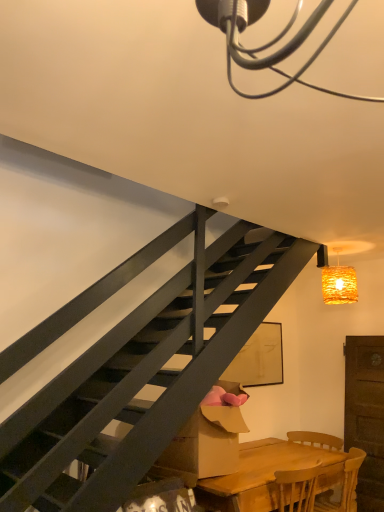
Question: Is wooden chair at lower right positioned beyond the bounds of wooden table at lower right?

Choices:
 (A) no
 (B) yes

Answer: (A)

Question: Would you consider wooden chair at lower right to be distant from wooden table at lower right?

Choices:
 (A) no
 (B) yes

Answer: (A)

Question: Does wooden chair at lower right have a lesser width compared to wooden table at lower right?

Choices:
 (A) yes
 (B) no

Answer: (A)

Question: Does wooden chair at lower right have a lesser height compared to wooden table at lower right?

Choices:
 (A) no
 (B) yes

Answer: (B)

Question: From a real-world perspective, is wooden chair at lower right under wooden table at lower right?

Choices:
 (A) yes
 (B) no

Answer: (B)

Question: Relative to cardboard box at lower center, is woven wicker lampshade at upper right in front or behind?

Choices:
 (A) front
 (B) behind

Answer: (B)

Question: In terms of size, does woven wicker lampshade at upper right appear bigger or smaller than cardboard box at lower center?

Choices:
 (A) big
 (B) small

Answer: (B)

Question: Based on their positions, is woven wicker lampshade at upper right located to the left or right of cardboard box at lower center?

Choices:
 (A) right
 (B) left

Answer: (A)

Question: From the image's perspective, is woven wicker lampshade at upper right positioned above or below cardboard box at lower center?

Choices:
 (A) above
 (B) below

Answer: (A)

Question: Considering their positions, is woven wicker lampshade at upper right located in front of or behind wooden chair at lower right?

Choices:
 (A) front
 (B) behind

Answer: (B)

Question: Considering the relative positions of woven wicker lampshade at upper right and wooden chair at lower right in the image provided, is woven wicker lampshade at upper right to the left or to the right of wooden chair at lower right?

Choices:
 (A) right
 (B) left

Answer: (A)

Question: From the image's perspective, is woven wicker lampshade at upper right positioned above or below wooden chair at lower right?

Choices:
 (A) below
 (B) above

Answer: (B)

Question: Choose the correct answer: Is woven wicker lampshade at upper right inside wooden chair at lower right or outside it?

Choices:
 (A) outside
 (B) inside

Answer: (A)

Question: From the image's perspective, is wooden chair at lower right located above or below cardboard box at lower center?

Choices:
 (A) above
 (B) below

Answer: (B)

Question: Considering the relative positions of wooden chair at lower right and cardboard box at lower center in the image provided, is wooden chair at lower right to the left or to the right of cardboard box at lower center?

Choices:
 (A) left
 (B) right

Answer: (B)